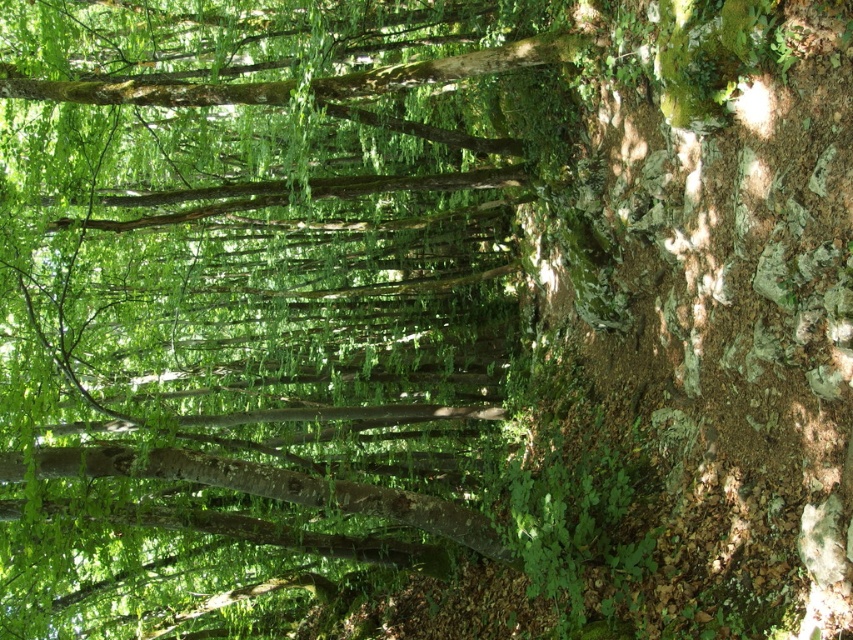
You are standing in the forest and want to touch the green leafy tree at center and the smooth brown tree trunk at center. Which one would you reach first?

The green leafy tree at center is closer to the viewer than the smooth brown tree trunk at center, so you would reach the green leafy tree at center first.